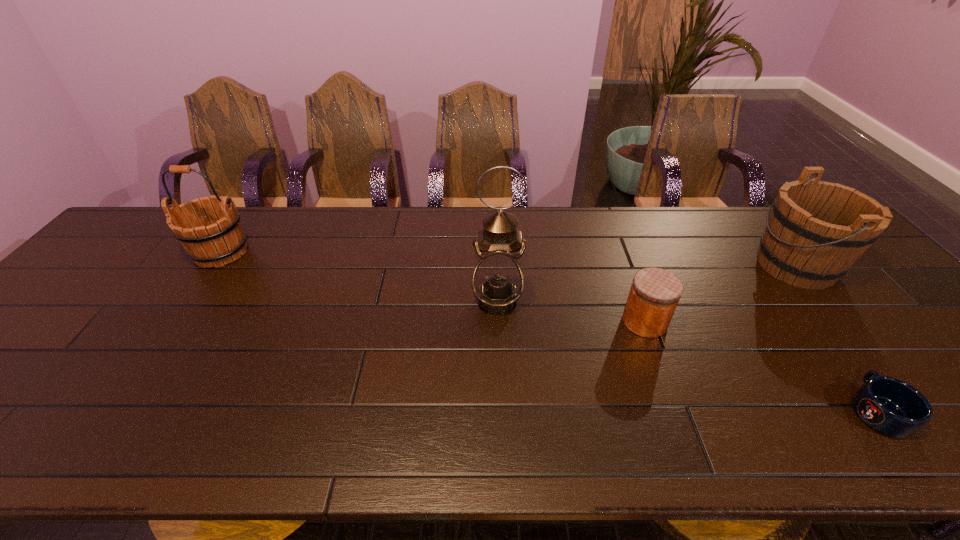
At what (x,y) coordinates should I click in order to perform the action: click on vacant point located 0.050m on the left of the leftmost object. Please return your answer as a coordinate pair (x, y). Looking at the image, I should click on (172, 253).

Where is `vacant space located 0.310m on the side of the right wine bucket with the handle for carrying`? vacant space located 0.310m on the side of the right wine bucket with the handle for carrying is located at coordinates (645, 265).

The height and width of the screenshot is (540, 960). Identify the location of free spot located on the side of the right wine bucket with the handle for carrying. (656, 265).

Find the location of a particular element. vacant space situated on the side of the right wine bucket with the handle for carrying is located at coordinates (730, 265).

What are the coordinates of `vacant space located on the front of the jar` in the screenshot? It's located at (670, 389).

This screenshot has height=540, width=960. I want to click on free spot located 0.250m with the handle on the side of the nearest object, so click(797, 303).

Image resolution: width=960 pixels, height=540 pixels. Identify the location of free space located 0.360m with the handle on the side of the nearest object. (776, 275).

The width and height of the screenshot is (960, 540). Find the location of `vacant space located with the handle on the side of the nearest object`. vacant space located with the handle on the side of the nearest object is located at coordinates (805, 314).

The width and height of the screenshot is (960, 540). In order to click on object present at the near edge in this screenshot , I will do `click(892, 407)`.

At what (x,y) coordinates should I click in order to perform the action: click on object that is at the right edge. Please return your answer as a coordinate pair (x, y). This screenshot has width=960, height=540. Looking at the image, I should click on (817, 230).